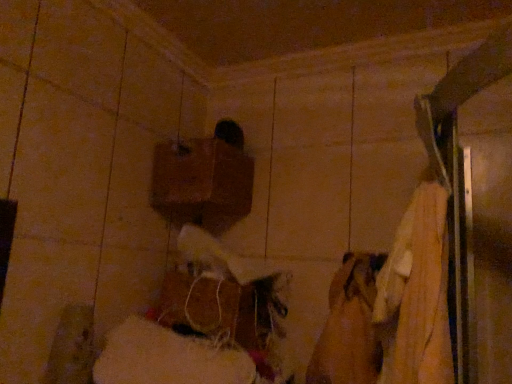
Question: Does point (154, 173) appear closer or farther from the camera than point (284, 334)?

Choices:
 (A) closer
 (B) farther

Answer: (B)

Question: Looking at the image, does brown matte wood at upper center, positioned as the 2th wood in bottom-to-top order, seem bigger or smaller compared to woodenmaterial/texture at center, the first wood positioned from the bottom?

Choices:
 (A) small
 (B) big

Answer: (A)

Question: Visually, is brown matte wood at upper center, positioned as the 2th wood in bottom-to-top order, positioned to the left or to the right of woodenmaterial/texture at center, the first wood positioned from the bottom?

Choices:
 (A) right
 (B) left

Answer: (B)

Question: In terms of height, does woodenmaterial/texture at center, which ranks as the second wood in top-to-bottom order, look taller or shorter compared to brown matte wood at upper center, positioned as the 2th wood in bottom-to-top order?

Choices:
 (A) short
 (B) tall

Answer: (A)

Question: Is woodenmaterial/texture at center, the first wood positioned from the bottom, wider or thinner than brown matte wood at upper center, positioned as the 2th wood in bottom-to-top order?

Choices:
 (A) wide
 (B) thin

Answer: (B)

Question: In terms of size, does woodenmaterial/texture at center, which ranks as the second wood in top-to-bottom order, appear bigger or smaller than brown matte wood at upper center, marked as the 1th wood in a top-to-bottom arrangement?

Choices:
 (A) small
 (B) big

Answer: (B)

Question: Is woodenmaterial/texture at center, which ranks as the second wood in top-to-bottom order, to the left or to the right of brown matte wood at upper center, positioned as the 2th wood in bottom-to-top order, in the image?

Choices:
 (A) right
 (B) left

Answer: (A)